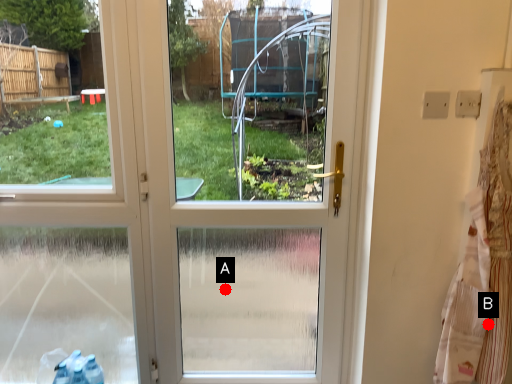
Question: Two points are circled on the image, labeled by A and B beside each circle. Which point appears closest to the camera in this image?

Choices:
 (A) A is closer
 (B) B is closer

Answer: (B)